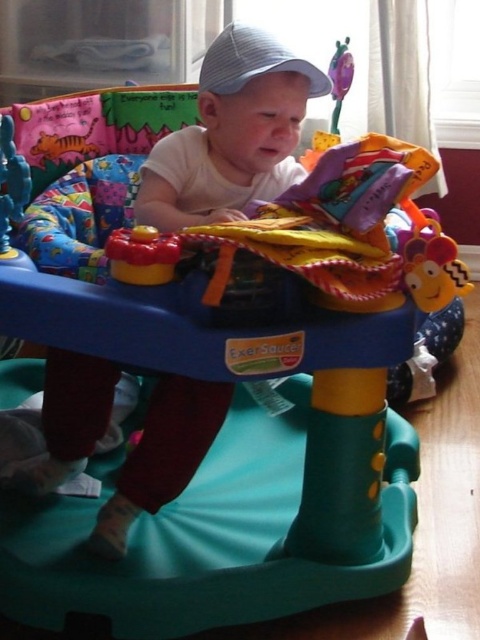
Question: Observing the image, what is the correct spatial positioning of white cotton baby at center in reference to rubberized plastic rattle at upper center?

Choices:
 (A) left
 (B) right

Answer: (A)

Question: Can you confirm if rubberized yellow and red toy at center is positioned to the right of rubberized plastic rattle at upper center?

Choices:
 (A) yes
 (B) no

Answer: (B)

Question: Among these points, which one is farthest from the camera?

Choices:
 (A) (16, 205)
 (B) (213, 173)

Answer: (B)

Question: Is white cotton baby at center to the right of rubberized plastic rattle at upper center from the viewer's perspective?

Choices:
 (A) yes
 (B) no

Answer: (B)

Question: Which is farther from the rubberized plastic rattle at upper center?

Choices:
 (A) white fabric hat at upper center
 (B) white cotton baby at center
 (C) rubberized plastic toy at center
 (D) rubberized yellow and red toy at center

Answer: (D)

Question: Which point is closer to the camera?

Choices:
 (A) (348, 72)
 (B) (108, 198)
 (C) (14, 177)

Answer: (C)